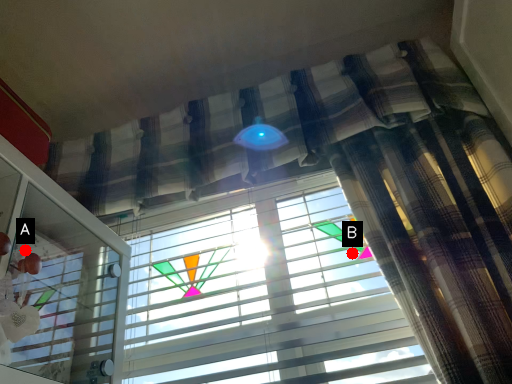
Question: Two points are circled on the image, labeled by A and B beside each circle. Among these points, which one is nearest to the camera?

Choices:
 (A) A is closer
 (B) B is closer

Answer: (A)